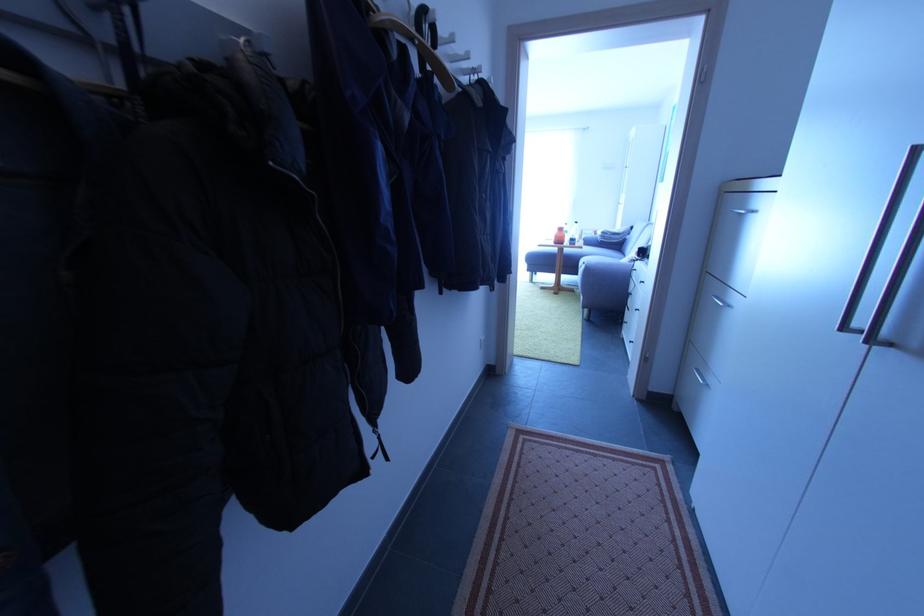
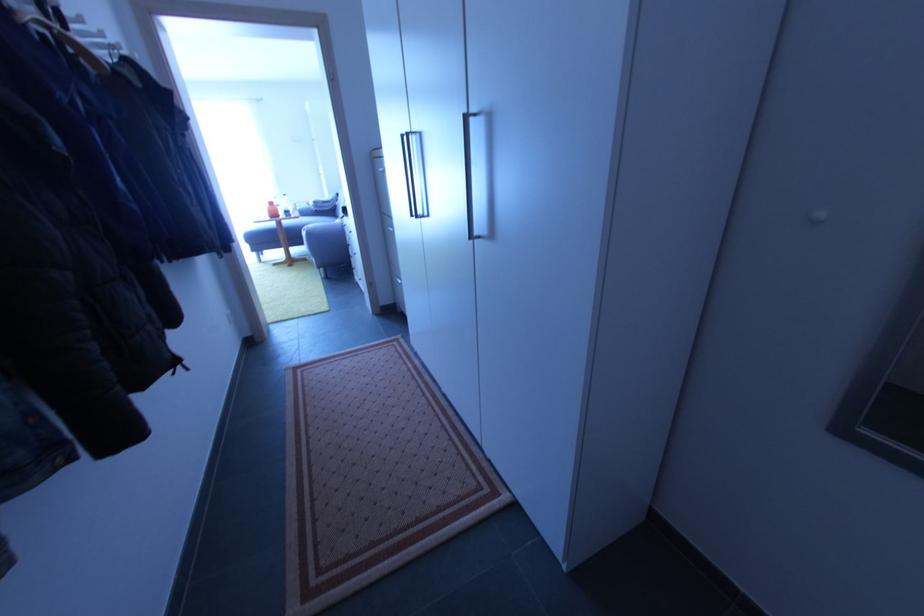
In the second image, find the point that corresponds to the point at 580,276 in the first image.

(308, 245)